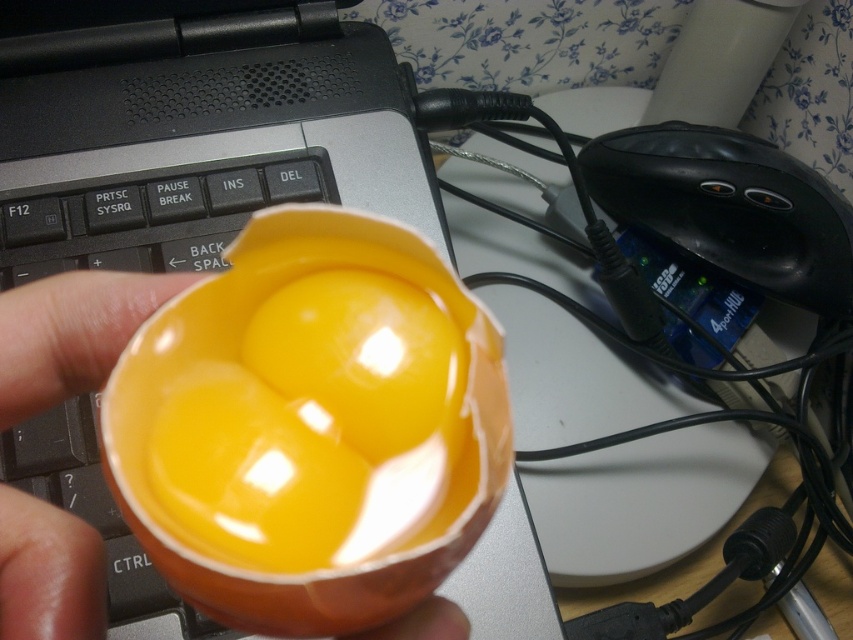
Question: Which object is closer to the camera taking this photo?

Choices:
 (A) black matte keyboard at center
 (B) orange glossy egg at center

Answer: (B)

Question: Is orange glossy egg at center to the left of black matte keyboard at center from the viewer's perspective?

Choices:
 (A) yes
 (B) no

Answer: (B)

Question: Does orange glossy egg at center appear under black matte keyboard at center?

Choices:
 (A) yes
 (B) no

Answer: (A)

Question: Can you confirm if orange glossy egg at center is bigger than black matte keyboard at center?

Choices:
 (A) no
 (B) yes

Answer: (A)